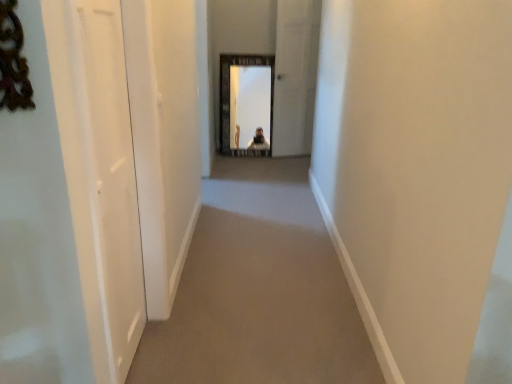
Question: Is white glossy door at center, acting as the 1th screen door starting from the right, at the back of white glossy door at left, placed as the 2th screen door when sorted from right to left?

Choices:
 (A) yes
 (B) no

Answer: (B)

Question: Is white glossy door at left, placed as the 2th screen door when sorted from right to left, closer to the viewer compared to white glossy door at center, which is counted as the 2th screen door, starting from the left?

Choices:
 (A) no
 (B) yes

Answer: (B)

Question: Is white glossy door at left, acting as the 1th screen door starting from the front, far away from white glossy door at center, positioned as the 1th screen door in top-to-bottom order?

Choices:
 (A) no
 (B) yes

Answer: (B)

Question: Considering the relative positions of white glossy door at left, which ranks as the 2th screen door in top-to-bottom order, and white glossy door at center, positioned as the 1th screen door in top-to-bottom order, in the image provided, is white glossy door at left, which ranks as the 2th screen door in top-to-bottom order, to the left of white glossy door at center, positioned as the 1th screen door in top-to-bottom order, from the viewer's perspective?

Choices:
 (A) no
 (B) yes

Answer: (B)

Question: From the image's perspective, would you say white glossy door at left, the 1th screen door when ordered from bottom to top, is shown under white glossy door at center, the first screen door viewed from the back?

Choices:
 (A) yes
 (B) no

Answer: (A)

Question: From a real-world perspective, relative to beige carpet at center, is white glossy door at center, the first screen door viewed from the back, vertically above or below?

Choices:
 (A) above
 (B) below

Answer: (A)

Question: In terms of width, does white glossy door at center, the 2th screen door viewed from the front, look wider or thinner when compared to beige carpet at center?

Choices:
 (A) thin
 (B) wide

Answer: (A)

Question: From their relative heights in the image, would you say white glossy door at center, the second screen door in the bottom-to-top sequence, is taller or shorter than beige carpet at center?

Choices:
 (A) tall
 (B) short

Answer: (A)

Question: Relative to beige carpet at center, is white glossy door at center, the 2th screen door viewed from the front, in front or behind?

Choices:
 (A) front
 (B) behind

Answer: (B)

Question: Which is correct: beige carpet at center is inside white glossy door at left, acting as the first screen door starting from the left, or outside of it?

Choices:
 (A) outside
 (B) inside

Answer: (A)

Question: Relative to white glossy door at left, acting as the first screen door starting from the left, is beige carpet at center in front or behind?

Choices:
 (A) behind
 (B) front

Answer: (A)

Question: Looking at their shapes, would you say beige carpet at center is wider or thinner than white glossy door at left, which ranks as the 2th screen door in top-to-bottom order?

Choices:
 (A) wide
 (B) thin

Answer: (A)

Question: From the image's perspective, is beige carpet at center above or below white glossy door at left, placed as the 2th screen door when sorted from right to left?

Choices:
 (A) below
 (B) above

Answer: (A)

Question: From a real-world perspective, relative to white glossy door at center, positioned as the 1th screen door in top-to-bottom order, is white glossy door at left, acting as the 1th screen door starting from the front, vertically above or below?

Choices:
 (A) above
 (B) below

Answer: (B)

Question: Relative to white glossy door at center, acting as the 1th screen door starting from the right, is white glossy door at left, the 1th screen door when ordered from bottom to top, in front or behind?

Choices:
 (A) behind
 (B) front

Answer: (B)